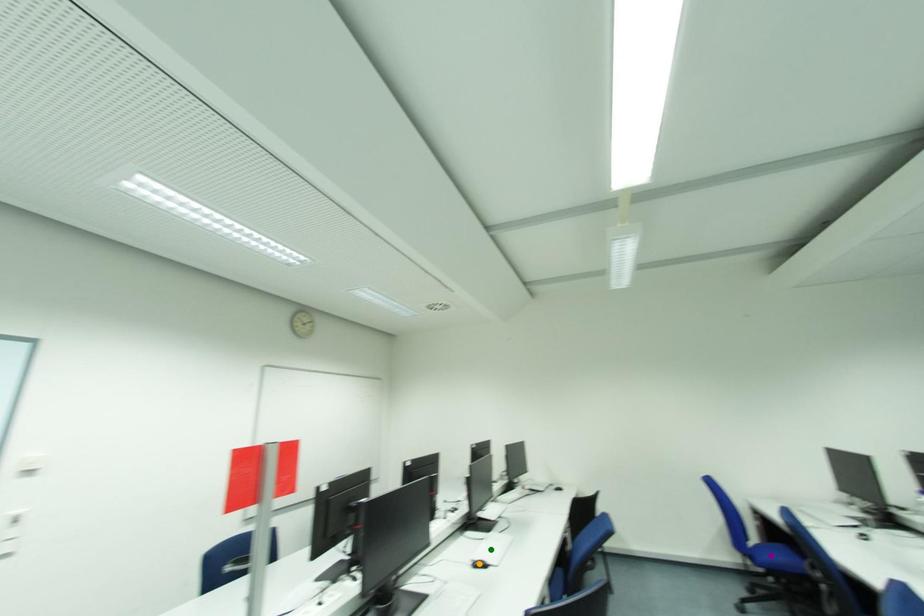
Order these from farthest to nearest:
purple point
orange point
green point

green point → orange point → purple point